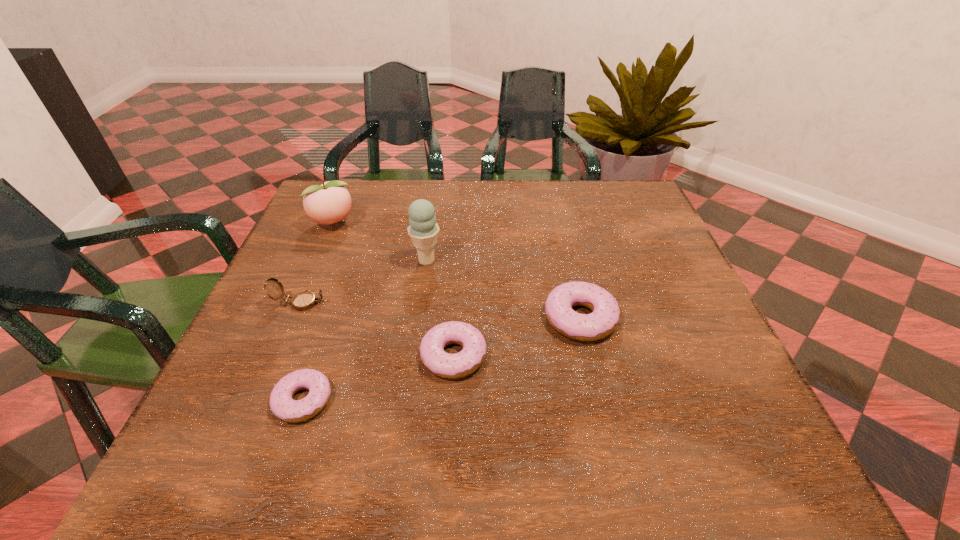
Locate an element on the screen. This screenshot has height=540, width=960. compass located at the left edge is located at coordinates [305, 300].

This screenshot has height=540, width=960. I want to click on object located at the far left corner, so click(328, 203).

Locate an element on the screen. This screenshot has width=960, height=540. object located in the near left corner section of the desktop is located at coordinates (282, 405).

This screenshot has height=540, width=960. I want to click on vacant space at the far edge of the desktop, so [486, 224].

Image resolution: width=960 pixels, height=540 pixels. Identify the location of free space at the near edge of the desktop. (428, 389).

In the image, there is a desktop. Identify the location of vacant space at the left edge. (329, 248).

Locate an element on the screen. The image size is (960, 540). vacant area at the right edge is located at coordinates (678, 300).

Image resolution: width=960 pixels, height=540 pixels. I want to click on vacant area at the far left corner, so coord(355,218).

Locate an element on the screen. The image size is (960, 540). blank space at the far right corner is located at coordinates (600, 217).

Find the location of a particular element. The image size is (960, 540). vacant area at the near right corner of the desktop is located at coordinates (744, 390).